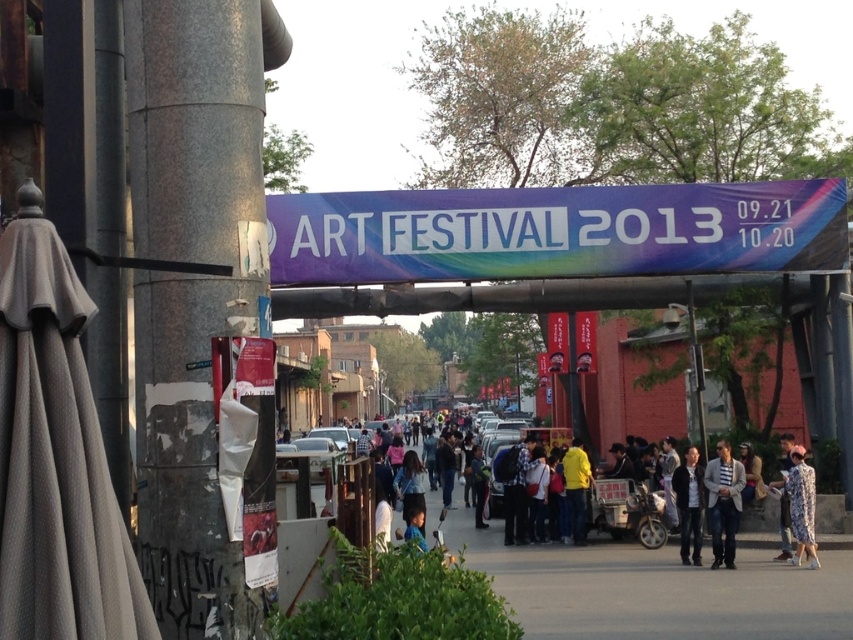
Question: Which point appears farthest from the camera in this image?

Choices:
 (A) (579, 502)
 (B) (718, 509)

Answer: (A)

Question: Does white fabric banner at center appear on the right side of floral dress at center?

Choices:
 (A) no
 (B) yes

Answer: (A)

Question: Can you confirm if gray concrete pillar at left is wider than dark gray jacket at center?

Choices:
 (A) yes
 (B) no

Answer: (A)

Question: Can you confirm if gray concrete pillar at left is wider than striped cotton shirt at center?

Choices:
 (A) yes
 (B) no

Answer: (A)

Question: Which object is farther from the camera taking this photo?

Choices:
 (A) striped cotton shirt at center
 (B) white fabric banner at center
 (C) yellow matte jacket at center
 (D) dark gray jacket at center

Answer: (C)

Question: Which object is the farthest from the yellow matte jacket at center?

Choices:
 (A) floral dress at center
 (B) dark gray jacket at center

Answer: (A)